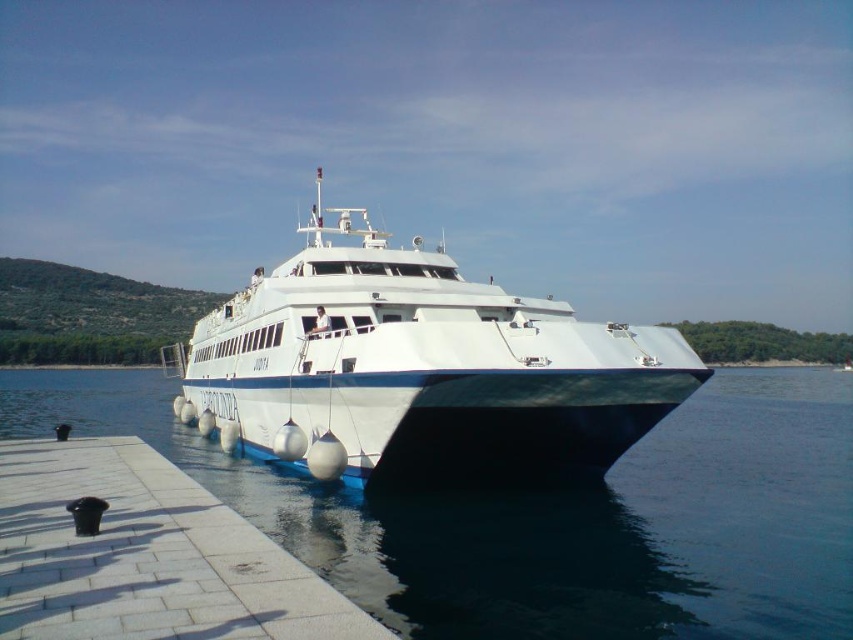
You are standing on the pier and want to locate the clear blue water at center. According to the coordinates provided, in which direction should you look relative to your position?

The clear blue water at center is located at coordinates point (552,516). Since you are on the pier, you should look towards the center of the image where the coordinates indicate the position of the clear blue water at center.

You are a delivery person needing to transport a 10 meter long cargo container from the white glossy boat at center to the white tile dock at lower left. Can the container be moved in one piece without bending or cutting it?

The distance between the white glossy boat at center and the white tile dock at lower left is 9.24 meters, so the 10 meter long cargo container cannot be moved in one piece without bending or cutting it because it is longer than the available space.

You are a passenger on the ferry named JUDITA. You want to disembark and walk to the white tile dock at lower left. Which direction should you walk from the white glossy boat at center?

Since the white glossy boat at center is positioned on the left side of the white tile dock at lower left, you should walk to the right to reach the white tile dock at lower left from the white glossy boat at center.